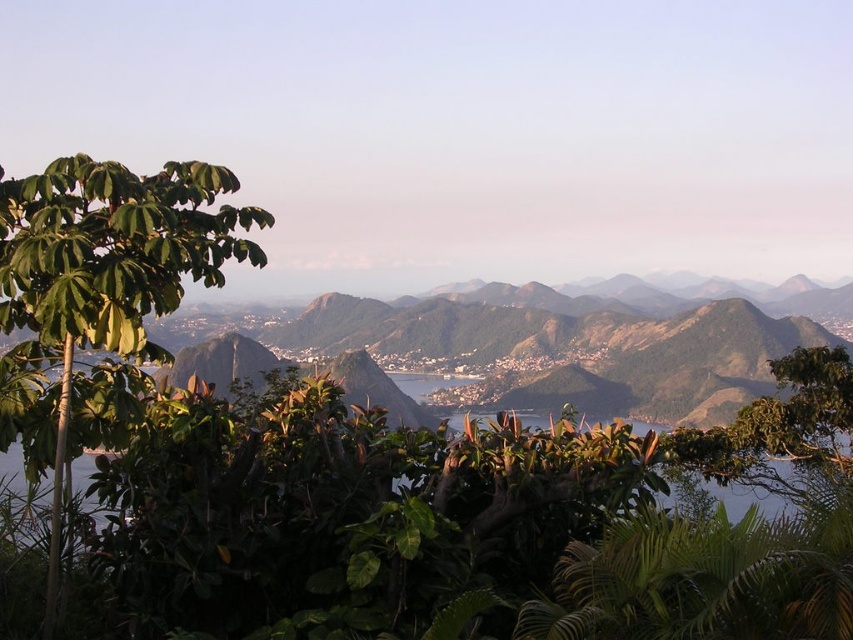
Does green leafy tree at left have a greater height compared to green leafy tree at center?

Indeed, green leafy tree at left has a greater height compared to green leafy tree at center.

Is green leafy tree at left behind green leafy tree at center?

No.

The image size is (853, 640). What do you see at coordinates (106, 276) in the screenshot? I see `green leafy tree at left` at bounding box center [106, 276].

The image size is (853, 640). Find the location of `green leafy tree at left`. green leafy tree at left is located at coordinates (106, 276).